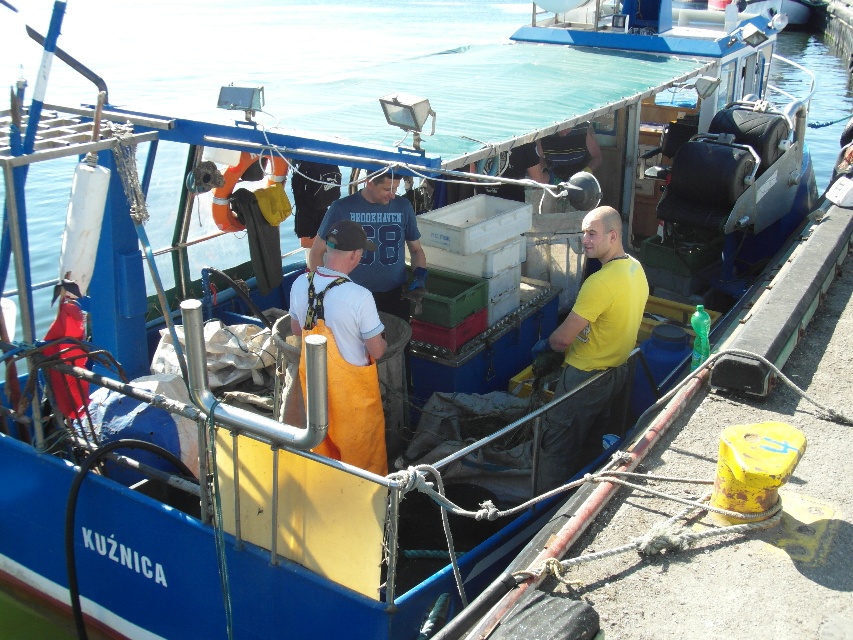
Which is more to the right, yellow matte shirt at center or orange waterproof overalls at center?

yellow matte shirt at center is more to the right.

Which is in front, point (566, 353) or point (328, 368)?

Point (328, 368) is in front.

In order to click on yellow matte shirt at center in this screenshot , I will do `click(590, 348)`.

Does orange waterproof overalls at center have a larger size compared to matte blue t-shirt at center?

Incorrect, orange waterproof overalls at center is not larger than matte blue t-shirt at center.

Is point (335, 280) in front of point (337, 204)?

Yes, point (335, 280) is in front of point (337, 204).

Which is behind, point (321, 284) or point (396, 200)?

The point (396, 200) is behind.

Find the location of a particular element. orange waterproof overalls at center is located at coordinates (345, 348).

Who is lower down, yellow matte shirt at center or matte blue t-shirt at center?

Positioned lower is yellow matte shirt at center.

Is yellow matte shirt at center further to the viewer compared to matte blue t-shirt at center?

No.

Describe the element at coordinates (590, 348) in the screenshot. I see `yellow matte shirt at center` at that location.

In order to click on yellow matte shirt at center in this screenshot , I will do `click(590, 348)`.